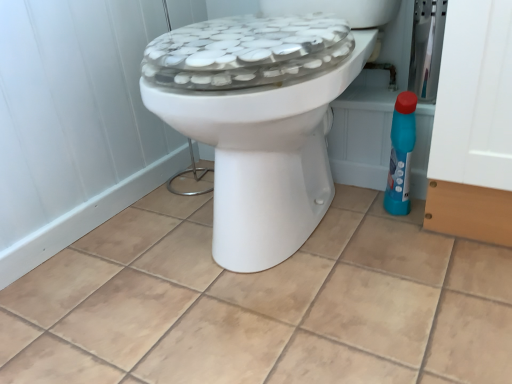
Where is `vacant space positioned to the left of blue plastic bottle at right`? vacant space positioned to the left of blue plastic bottle at right is located at coordinates (347, 212).